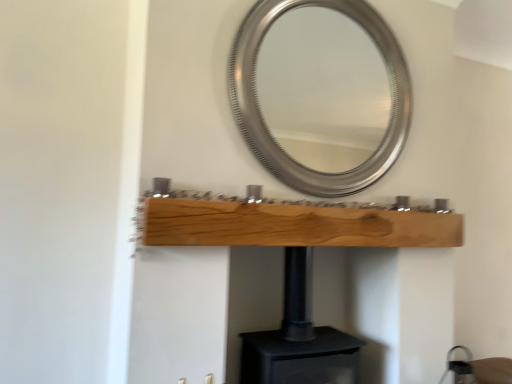
Question: Is the depth of silver metallic mirror at upper center greater than that of black matte fireplace at center?

Choices:
 (A) yes
 (B) no

Answer: (A)

Question: Is silver metallic mirror at upper center surrounding black matte fireplace at center?

Choices:
 (A) yes
 (B) no

Answer: (B)

Question: Is silver metallic mirror at upper center smaller than black matte fireplace at center?

Choices:
 (A) no
 (B) yes

Answer: (B)

Question: Can you confirm if silver metallic mirror at upper center is wider than black matte fireplace at center?

Choices:
 (A) no
 (B) yes

Answer: (A)

Question: Is silver metallic mirror at upper center facing away from black matte fireplace at center?

Choices:
 (A) yes
 (B) no

Answer: (B)

Question: Is point pos(164,244) positioned closer to the camera than point pos(346,87)?

Choices:
 (A) closer
 (B) farther

Answer: (A)

Question: Is natural wood plank at center wider or thinner than silver metallic mirror at upper center?

Choices:
 (A) thin
 (B) wide

Answer: (B)

Question: Do you think natural wood plank at center is within silver metallic mirror at upper center, or outside of it?

Choices:
 (A) inside
 (B) outside

Answer: (B)

Question: Considering the positions of natural wood plank at center and silver metallic mirror at upper center in the image, is natural wood plank at center taller or shorter than silver metallic mirror at upper center?

Choices:
 (A) short
 (B) tall

Answer: (A)

Question: Considering the positions of point (292, 122) and point (326, 231), is point (292, 122) closer or farther from the camera than point (326, 231)?

Choices:
 (A) farther
 (B) closer

Answer: (A)

Question: In terms of width, does silver metallic mirror at upper center look wider or thinner when compared to natural wood plank at center?

Choices:
 (A) wide
 (B) thin

Answer: (B)

Question: Is silver metallic mirror at upper center bigger or smaller than natural wood plank at center?

Choices:
 (A) small
 (B) big

Answer: (B)

Question: Is silver metallic mirror at upper center taller or shorter than natural wood plank at center?

Choices:
 (A) short
 (B) tall

Answer: (B)

Question: Considering the positions of natural wood plank at center and black matte fireplace at center in the image, is natural wood plank at center wider or thinner than black matte fireplace at center?

Choices:
 (A) thin
 (B) wide

Answer: (A)

Question: Is natural wood plank at center inside the boundaries of black matte fireplace at center, or outside?

Choices:
 (A) outside
 (B) inside

Answer: (A)